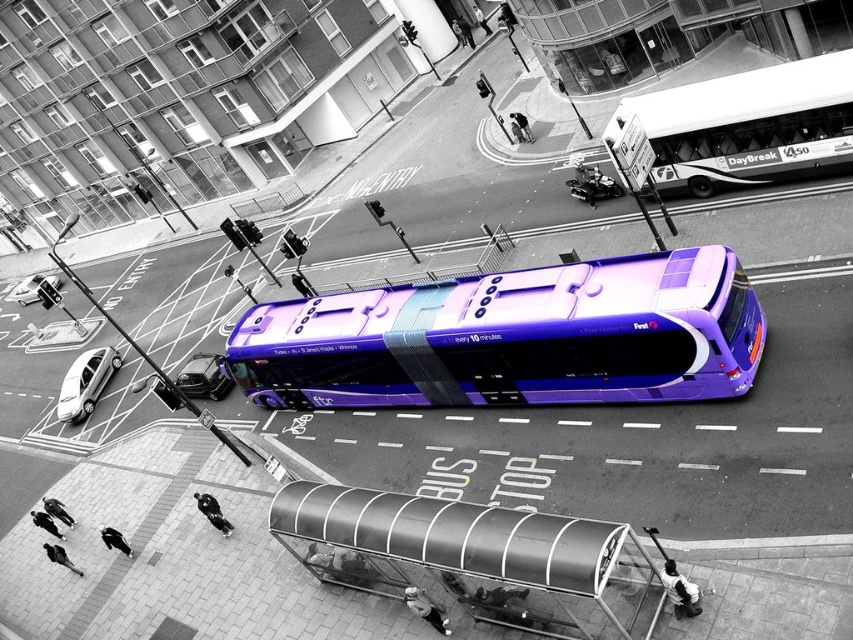
Question: From the image, what is the correct spatial relationship of white glossy bus at upper right in relation to metallic silver scooter at center?

Choices:
 (A) above
 (B) below

Answer: (B)

Question: Which point appears closest to the camera in this image?

Choices:
 (A) (38, 292)
 (B) (548, 636)
 (C) (740, 339)
 (D) (83, 396)

Answer: (B)

Question: Can you confirm if metallic silver bus stop at lower center is bigger than white glossy bus at upper right?

Choices:
 (A) yes
 (B) no

Answer: (A)

Question: Considering the real-world distances, which object is closest to the purple glossy bus at center?

Choices:
 (A) metallic silver scooter at center
 (B) silver metallic sedan at lower left
 (C) metallic silver car at lower left

Answer: (A)

Question: Does metallic silver scooter at center appear under metallic silver car at lower left?

Choices:
 (A) yes
 (B) no

Answer: (B)

Question: Which object appears closest to the camera in this image?

Choices:
 (A) metallic silver car at lower left
 (B) silver metallic sedan at lower left

Answer: (B)